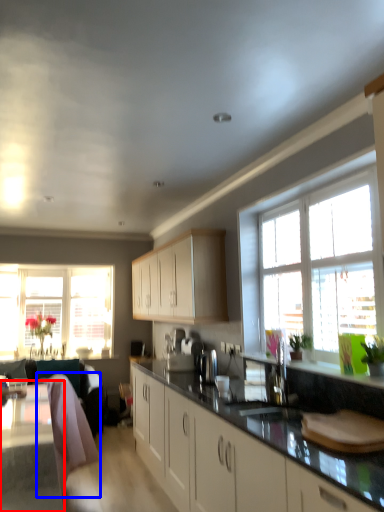
Question: Which object is closer to the camera taking this photo, table (highlighted by a red box) or swivel chair (highlighted by a blue box)?

Choices:
 (A) table
 (B) swivel chair

Answer: (A)